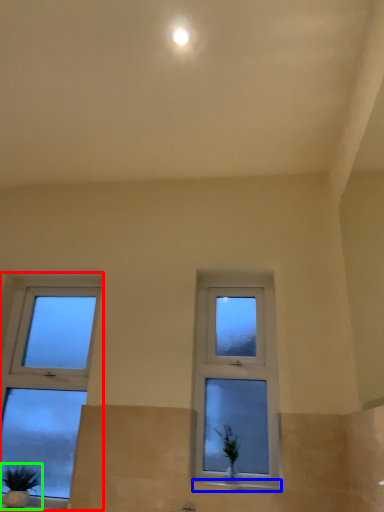
Question: Considering the real-world distances, which object is farthest from window (highlighted by a red box)? window sill (highlighted by a blue box) or houseplant (highlighted by a green box)?

Choices:
 (A) window sill
 (B) houseplant

Answer: (A)